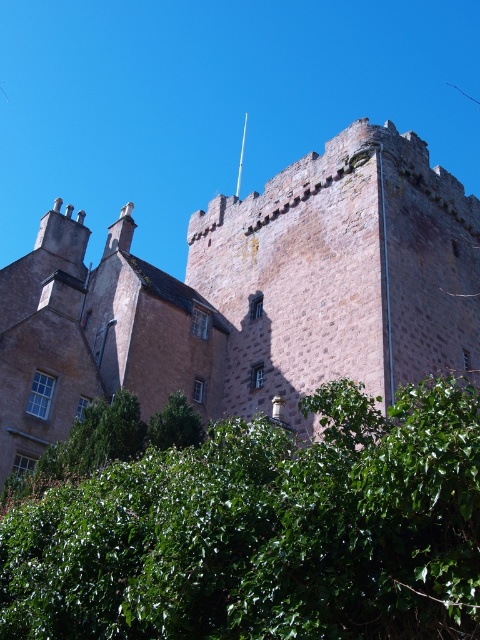
You are a visitor standing in front of the historic stone building. You notice the brown stone tower at upper center and the green leafy tree at lower center. Which object appears bigger in the image?

The brown stone tower at upper center appears bigger than the green leafy tree at lower center because it has a larger size compared to the tree.

You are a bird looking for a high perch to survey the surroundings. You see the brown stone tower at upper center and the green leafy bush at lower center. Which one should you choose to get a better view?

The brown stone tower at upper center is taller than the green leafy bush at lower center, so choosing the brown stone tower at upper center will provide a higher vantage point for a better view.